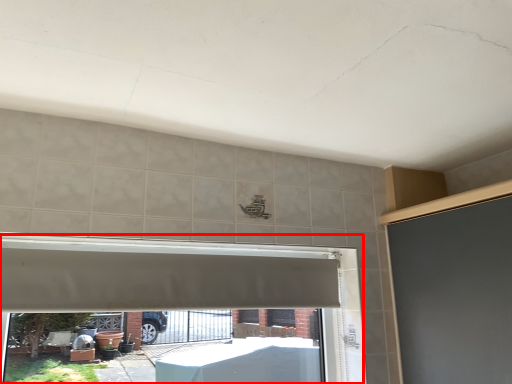
Question: Observing the image, what is the correct spatial positioning of window frame (annotated by the red box) in reference to exhaust hood?

Choices:
 (A) left
 (B) right

Answer: (A)